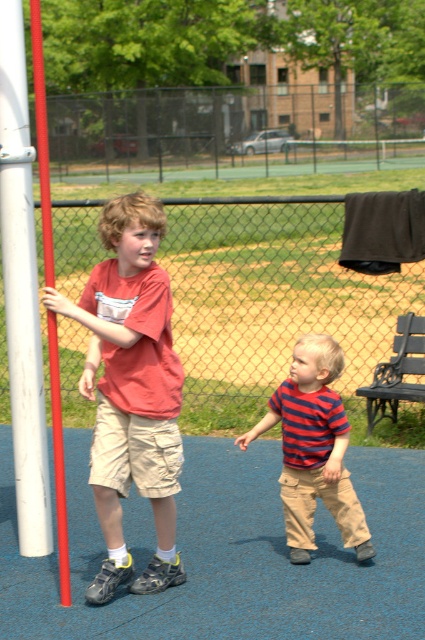
Question: Among these points, which one is nearest to the camera?

Choices:
 (A) (98, 388)
 (B) (340, 504)
 (C) (56, 472)

Answer: (C)

Question: Is striped cotton shirt at center to the left of white smooth pole at left from the viewer's perspective?

Choices:
 (A) yes
 (B) no

Answer: (B)

Question: Which of the following is the closest to the observer?

Choices:
 (A) (311, 433)
 (B) (170, 401)

Answer: (B)

Question: Does matte red t-shirt at left have a larger size compared to white smooth pole at left?

Choices:
 (A) no
 (B) yes

Answer: (A)

Question: Which point appears farthest from the camera in this image?

Choices:
 (A) click(x=119, y=243)
 (B) click(x=311, y=481)
 (C) click(x=64, y=504)

Answer: (B)

Question: Does matte red t-shirt at left appear under white smooth pole at left?

Choices:
 (A) no
 (B) yes

Answer: (B)